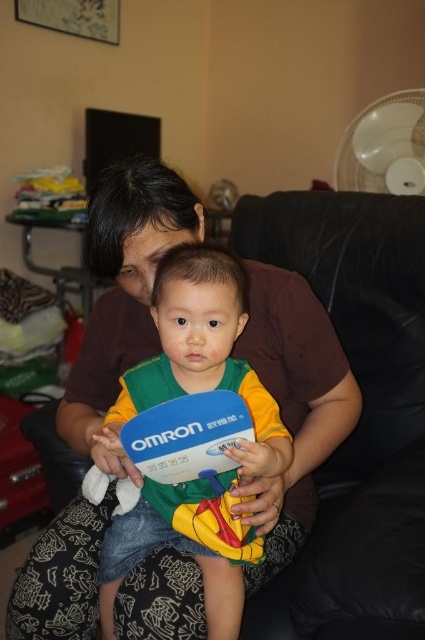
You are standing in the room and want to sit down on the black leather couch at center. Based on its position, which direction should you walk towards?

The black leather couch at center is located at point 0.650 on the x axis and 0.849 on the y axis. Since the coordinates are based on a 2D plane where the origin is at the bottom left corner, you should walk towards the upper right direction to reach it.

You are a guest entering the living room and see the black leather couch at center and the matte plastic toy at center. Which object is closer to you?

The black leather couch at center is positioned over matte plastic toy at center, so the couch is closer to you.